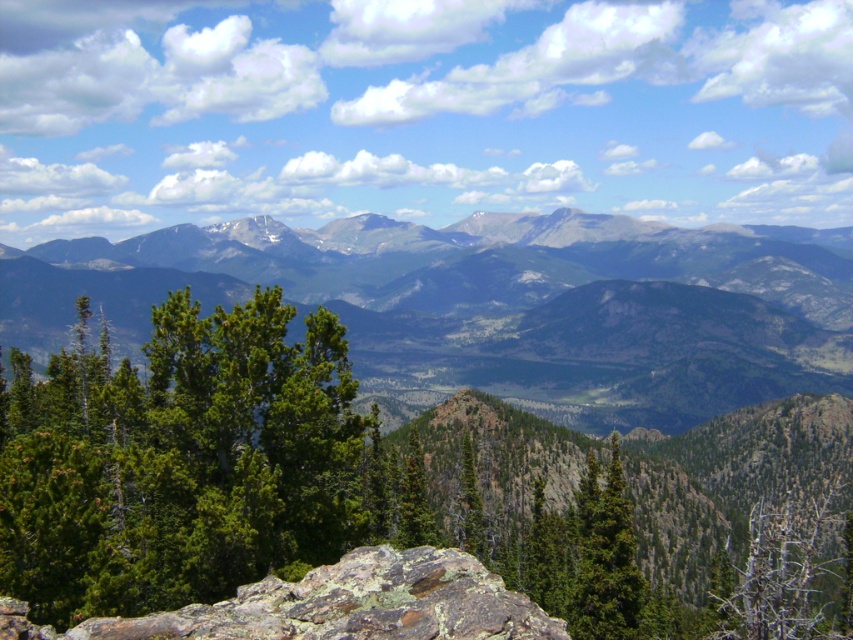
Find the location of `green forested mountain range at center`. green forested mountain range at center is located at coordinates (498, 304).

At what (x,y) coordinates should I click in order to perform the action: click on green forested mountain range at center. Please return your answer as a coordinate pair (x, y). Looking at the image, I should click on (498, 304).

In order to click on green forested mountain range at center in this screenshot , I will do `click(498, 304)`.

Does point (778, 566) lie in front of point (463, 492)?

That is True.

Can you confirm if dead wood at lower right is positioned to the right of green matte tree at center?

Yes, dead wood at lower right is to the right of green matte tree at center.

The image size is (853, 640). Find the location of `dead wood at lower right`. dead wood at lower right is located at coordinates (791, 572).

Does green needle-like at left have a greater width compared to dead wood at lower right?

In fact, green needle-like at left might be narrower than dead wood at lower right.

Describe the element at coordinates (178, 464) in the screenshot. The image size is (853, 640). I see `green needle-like at left` at that location.

Is point (213, 326) farther from viewer compared to point (782, 614)?

That is True.

Where is `green needle-like at left`? green needle-like at left is located at coordinates (178, 464).